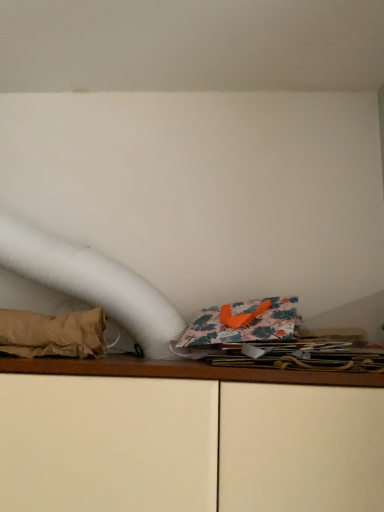
Question: In the image, is matte wooden cabinet at center positioned in front of or behind brown fabric at left?

Choices:
 (A) behind
 (B) front

Answer: (B)

Question: Is matte wooden cabinet at center wider or thinner than brown fabric at left?

Choices:
 (A) wide
 (B) thin

Answer: (A)

Question: Is matte wooden cabinet at center to the left or to the right of brown fabric at left in the image?

Choices:
 (A) right
 (B) left

Answer: (A)

Question: From the image's perspective, is brown fabric at left located above or below matte wooden cabinet at center?

Choices:
 (A) above
 (B) below

Answer: (A)

Question: In terms of size, does brown fabric at left appear bigger or smaller than matte wooden cabinet at center?

Choices:
 (A) small
 (B) big

Answer: (A)

Question: From their relative heights in the image, would you say brown fabric at left is taller or shorter than matte wooden cabinet at center?

Choices:
 (A) tall
 (B) short

Answer: (B)

Question: Is brown fabric at left spatially inside matte wooden cabinet at center, or outside of it?

Choices:
 (A) outside
 (B) inside

Answer: (A)